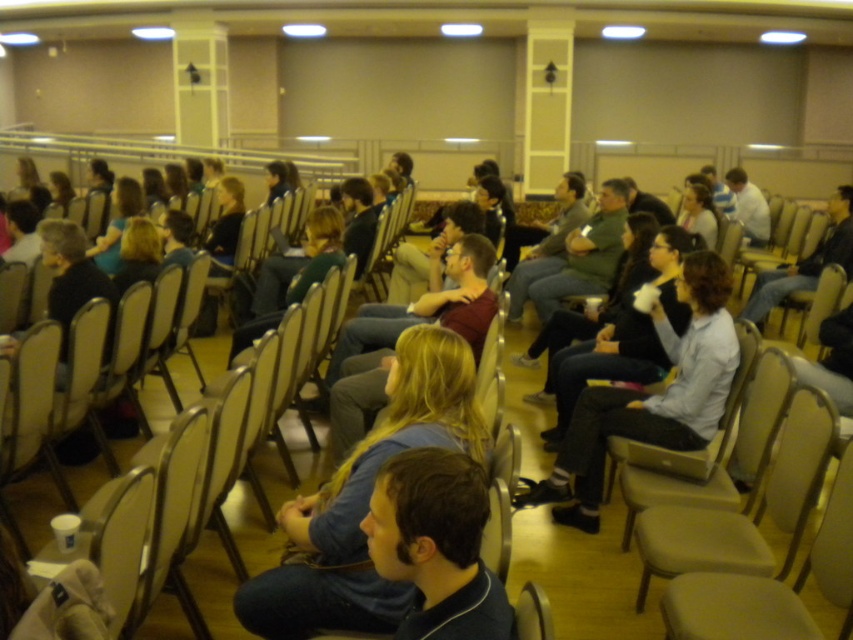
You are an event organizer and need to determine the seating arrangement. Since the blonde hair at center and the light brown leather jacket at center are both at the center, which one is taller?

The blonde hair at center is taller than the light brown leather jacket at center according to the description.

You are an event organizer checking the seating arrangement in the auditorium. You notice the dark blue shirt at center and the beige fabric chair at lower right. Which object is located higher in the image?

The dark blue shirt at center is positioned over the beige fabric chair at lower right, so it is higher in the image.

You are sitting at point (740, 317) and want to walk to the stage area. Is the point (846, 605) in your path towards the stage?

Yes, the point (846, 605) is in front of point (740, 317), so it is in your path towards the stage.